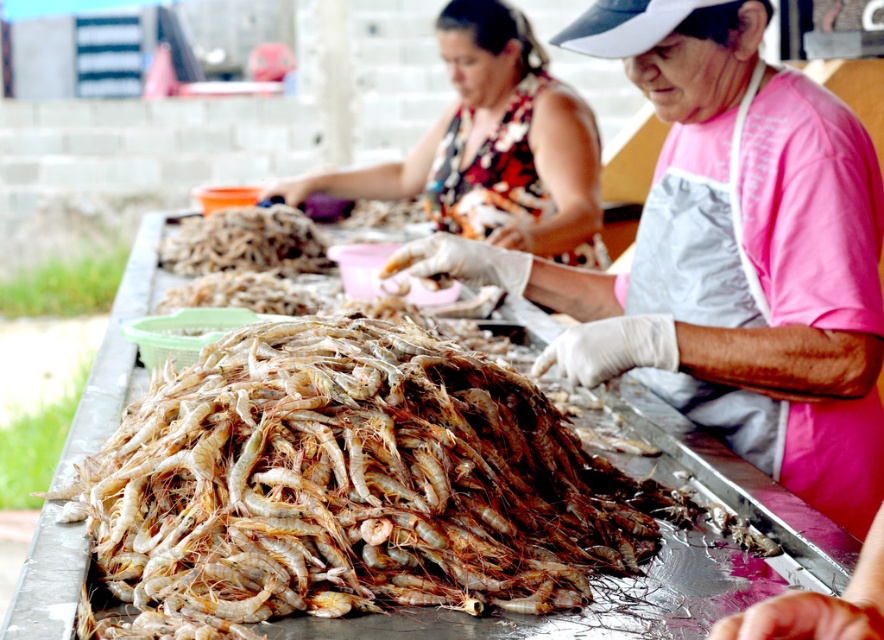
Question: Can you confirm if printed fabric blouse at upper center is bigger than translucent plastic tray at center?

Choices:
 (A) yes
 (B) no

Answer: (A)

Question: Which point is farther from the camera taking this photo?

Choices:
 (A) (215, 266)
 (B) (401, 172)
 (C) (692, 333)
 (D) (344, 513)

Answer: (B)

Question: Can you confirm if printed fabric blouse at upper center is bigger than translucent plastic tray at center?

Choices:
 (A) no
 (B) yes

Answer: (B)

Question: Can you confirm if pink fabric apron at center is thinner than translucent plastic tray at center?

Choices:
 (A) no
 (B) yes

Answer: (A)

Question: Among these objects, which one is farthest from the camera?

Choices:
 (A) pink fabric apron at center
 (B) translucent plastic tray at center
 (C) printed fabric blouse at upper center

Answer: (C)

Question: Considering the real-world distances, which object is farthest from the printed fabric blouse at upper center?

Choices:
 (A) translucent white shrimp at center
 (B) pink fabric apron at center

Answer: (A)